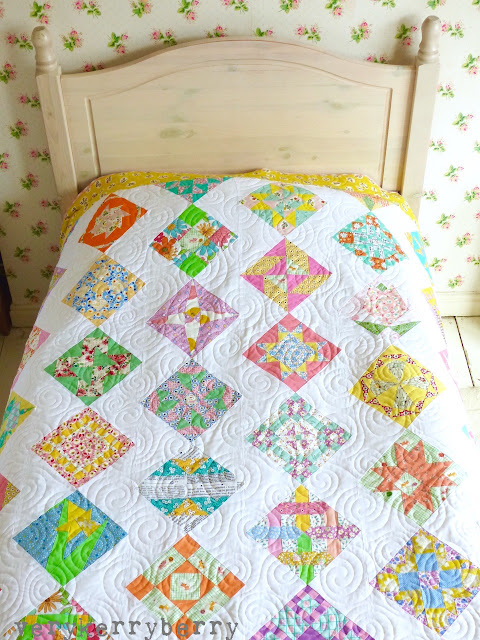
Where is `pillow`? pillow is located at coordinates (365, 177), (102, 179).